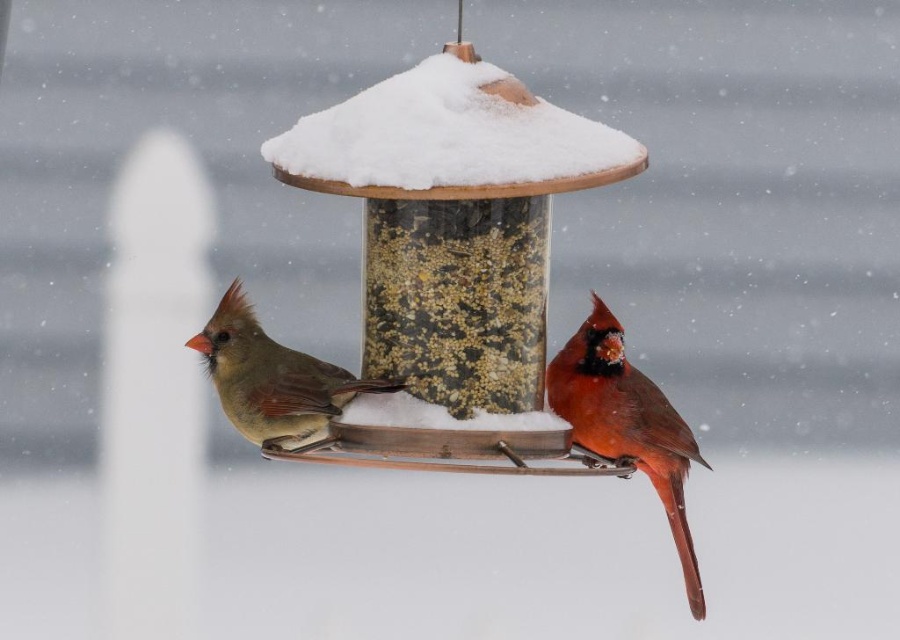
Consider the image. Measure the distance between point (580,154) and camera.

2.74 meters

Is white fluffy snow at center positioned in front of matte brown bird at left?

Yes, white fluffy snow at center is closer to the viewer.

What do you see at coordinates (450, 140) in the screenshot? I see `white fluffy snow at center` at bounding box center [450, 140].

At what (x,y) coordinates should I click in order to perform the action: click on white fluffy snow at center. Please return your answer as a coordinate pair (x, y). Looking at the image, I should click on (450, 140).

Is white fluffy snow at center in front of transparent plastic bird feeder at center?

No, white fluffy snow at center is further to the viewer.

Describe the element at coordinates (450, 140) in the screenshot. The height and width of the screenshot is (640, 900). I see `white fluffy snow at center` at that location.

Where is `white fluffy snow at center`? This screenshot has width=900, height=640. white fluffy snow at center is located at coordinates (450, 140).

In the scene shown: Is white fluffy snow at center shorter than shiny red cardinal at center?

Yes, white fluffy snow at center is shorter than shiny red cardinal at center.

From the picture: Who is lower down, white fluffy snow at center or shiny red cardinal at center?

shiny red cardinal at center

This screenshot has width=900, height=640. Describe the element at coordinates (450, 140) in the screenshot. I see `white fluffy snow at center` at that location.

Locate an element on the screen. Image resolution: width=900 pixels, height=640 pixels. white fluffy snow at center is located at coordinates (450, 140).